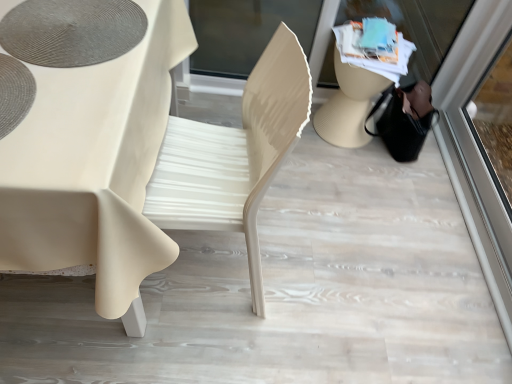
At what (x,y) coordinates should I click in order to perform the action: click on vacant space situated above matte gray placemat at upper left (from a real-world perspective). Please return your answer as a coordinate pair (x, y). Image resolution: width=512 pixels, height=384 pixels. Looking at the image, I should click on (78, 26).